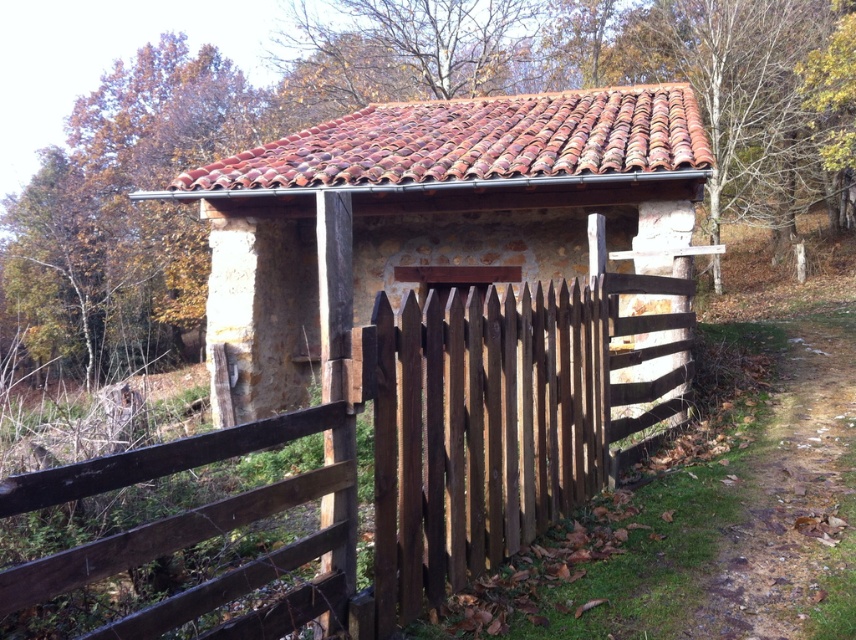
Does point (9, 584) lie in front of point (354, 250)?

That is True.

Can you confirm if brown wooden fence at center is wider than brown stone hut at center?

Indeed, brown wooden fence at center has a greater width compared to brown stone hut at center.

Between point (36, 481) and point (357, 310), which one is positioned in front?

Point (36, 481)

Where is `brown wooden fence at center`? brown wooden fence at center is located at coordinates (390, 460).